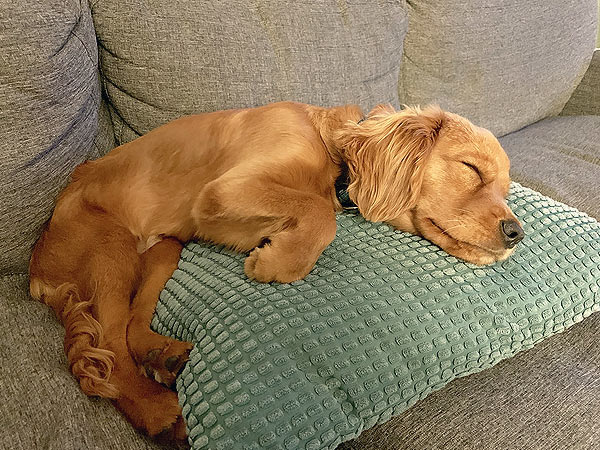
In order to click on pillow in this screenshot , I will do `click(306, 319)`.